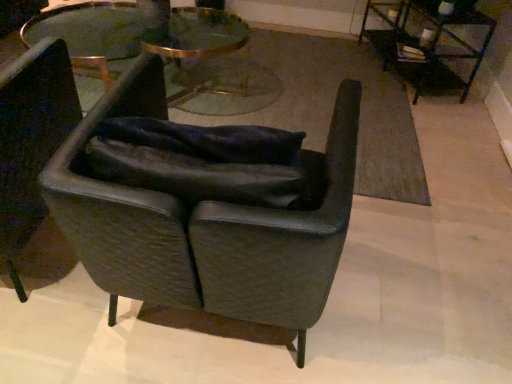
Question: Is leather armchair at center, which is the 2th chair in left-to-right order, to the left or to the right of metallic black table at upper right, the 1th table viewed from the right, in the image?

Choices:
 (A) right
 (B) left

Answer: (B)

Question: From the image's perspective, is leather armchair at center, which is the 2th chair in left-to-right order, above or below metallic black table at upper right, which ranks as the second table in left-to-right order?

Choices:
 (A) above
 (B) below

Answer: (B)

Question: Which of these objects is positioned farthest from the metallic black table at upper right, the 1th table viewed from the right?

Choices:
 (A) leather at left, placed as the first chair when sorted from left to right
 (B) clear glass table at center, the first table in the left-to-right sequence
 (C) leather armchair at center, which is the 2th chair in left-to-right order

Answer: (A)

Question: Based on their relative distances, which object is nearer to the leather at left, which appears as the second chair when viewed from the right?

Choices:
 (A) leather armchair at center, which is the 2th chair in left-to-right order
 (B) clear glass table at center, the second table from the right
 (C) metallic black table at upper right, which ranks as the second table in left-to-right order

Answer: (A)